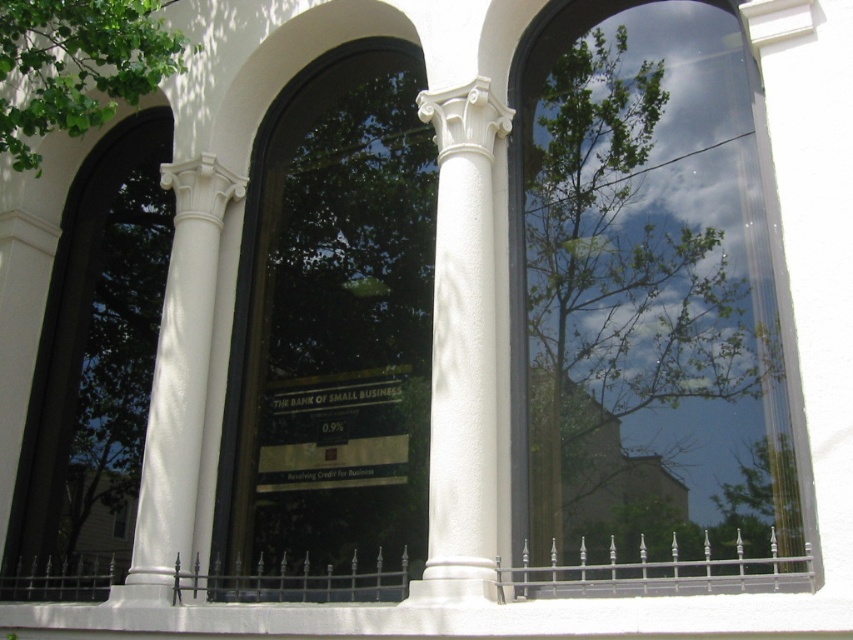
Question: In this image, where is green leafy tree at upper right located relative to white smooth column at center?

Choices:
 (A) left
 (B) right

Answer: (B)

Question: Is green leafy tree at upper right below white smooth column at center?

Choices:
 (A) no
 (B) yes

Answer: (A)

Question: Which point is farther to the camera?

Choices:
 (A) (155, 570)
 (B) (482, 394)
 (C) (527, 436)

Answer: (A)

Question: Which point is farther to the camera?

Choices:
 (A) (158, 51)
 (B) (437, 492)
 (C) (161, 552)

Answer: (A)

Question: Which point is closer to the camera?

Choices:
 (A) (740, 237)
 (B) (148, 452)
 (C) (131, 33)
 (D) (473, 566)

Answer: (D)

Question: Is green leafy tree at upper right smaller than green leafy tree at upper left?

Choices:
 (A) yes
 (B) no

Answer: (B)